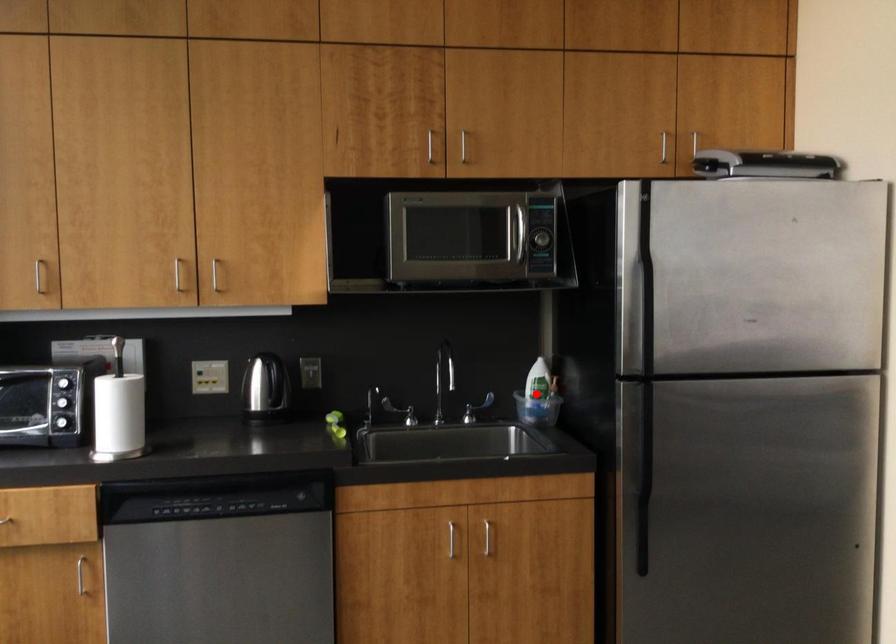
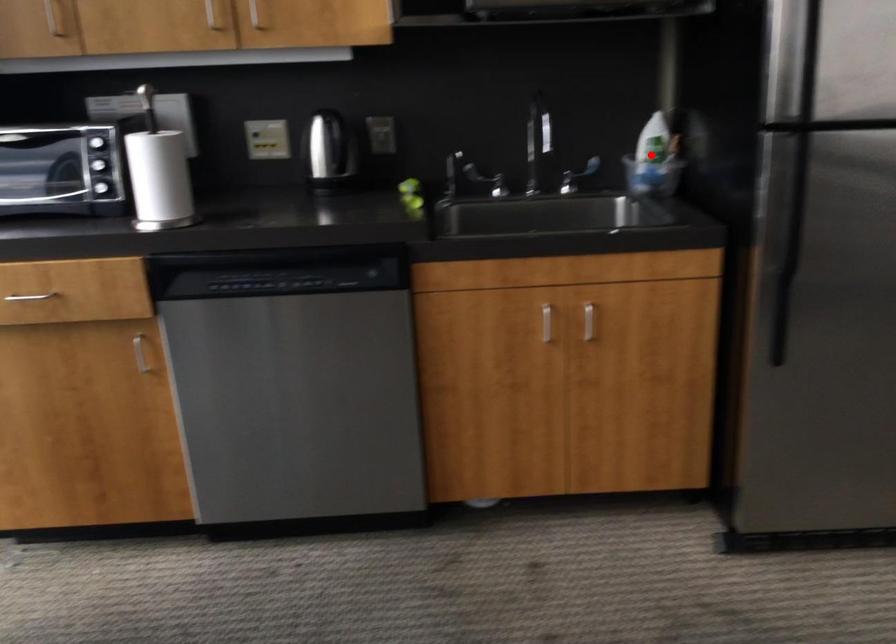
I am providing you with two images of the same scene from different viewpoints. A red point is marked on the first image and another point is marked on the second image. Is the marked point in image1 the same physical position as the marked point in image2?

Yes